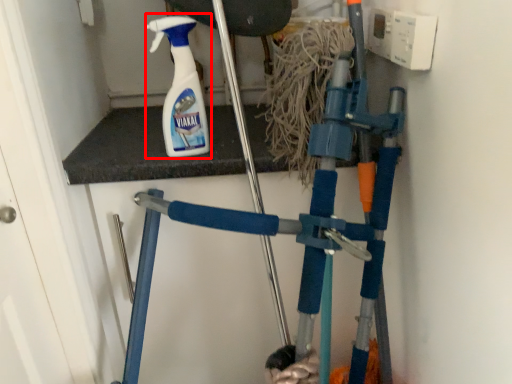
Question: From the image's perspective, considering the relative positions of cleaning product (annotated by the red box) and crutch in the image provided, where is cleaning product (annotated by the red box) located with respect to the staircase?

Choices:
 (A) above
 (B) below

Answer: (A)